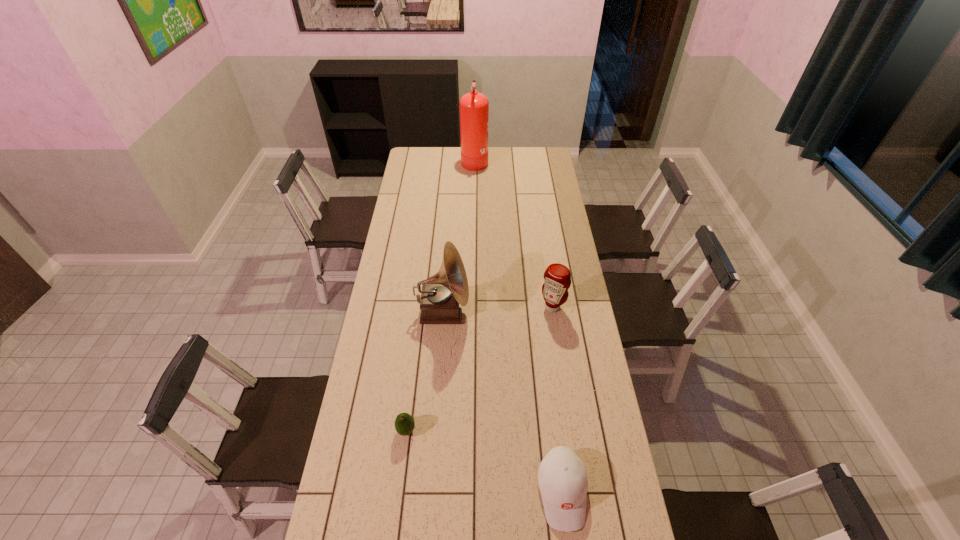
This screenshot has height=540, width=960. What are the coordinates of `blank space that satisfies the following two spatial constraints: 1. towards the nozzle of the farthest object; 2. on the left side of the condiment` in the screenshot? It's located at (472, 307).

This screenshot has height=540, width=960. What are the coordinates of `free space in the image that satisfies the following two spatial constraints: 1. on the back side of the condiment; 2. towards the nozzle of the tallest object` in the screenshot? It's located at (531, 160).

Where is `free location that satisfies the following two spatial constraints: 1. towards the nozzle of the condiment; 2. on the right side of the fire extinguisher`? The image size is (960, 540). free location that satisfies the following two spatial constraints: 1. towards the nozzle of the condiment; 2. on the right side of the fire extinguisher is located at coordinates (472, 307).